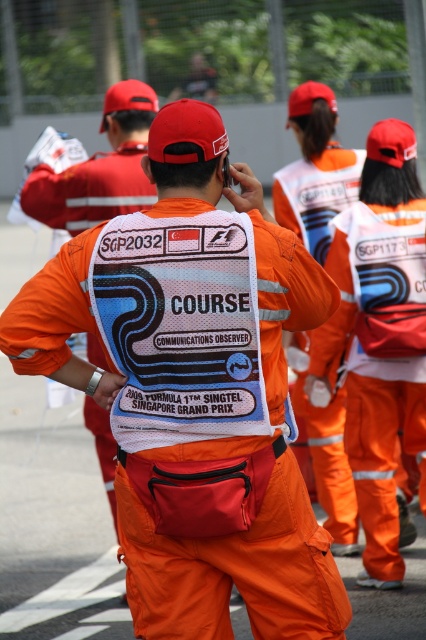
Which of these two, orange reflective uniform at center or orange reflective vest at center, stands shorter?

orange reflective vest at center is shorter.

Is point (385, 385) less distant than point (310, 211)?

Yes, point (385, 385) is closer to viewer.

Locate an element on the screen. orange reflective uniform at center is located at coordinates (382, 449).

Does point (327, 467) come closer to viewer compared to point (62, 198)?

No, (327, 467) is behind (62, 198).

In the scene shown: Can you confirm if orange reflective vest at center is positioned above orange fabric vest at center?

Incorrect, orange reflective vest at center is not positioned above orange fabric vest at center.

Is point (322, 448) less distant than point (141, 176)?

No, it is behind (141, 176).

The width and height of the screenshot is (426, 640). I want to click on orange reflective vest at center, so click(x=316, y=193).

Which is more to the right, orange reflective uniform at center or orange fabric vest at center?

orange reflective uniform at center is more to the right.

Does orange reflective uniform at center have a larger size compared to orange fabric vest at center?

Yes, orange reflective uniform at center is bigger than orange fabric vest at center.

Is point (379, 481) behind point (46, 202)?

That is False.

Locate an element on the screen. The height and width of the screenshot is (640, 426). orange reflective uniform at center is located at coordinates (382, 449).